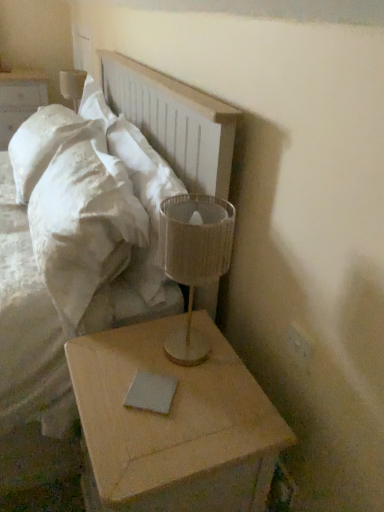
Question: From the image's perspective, is translucent fabric lampshade at right, the second table lamp positioned from the left, on top of white matte nightstand at upper left, acting as the first nightstand starting from the back?

Choices:
 (A) no
 (B) yes

Answer: (A)

Question: From a real-world perspective, is translucent fabric lampshade at right, which is counted as the 2th table lamp, starting from the back, located beneath white matte nightstand at upper left, the second nightstand in the right-to-left sequence?

Choices:
 (A) no
 (B) yes

Answer: (A)

Question: Considering the relative sizes of translucent fabric lampshade at right, the second table lamp positioned from the left, and white matte nightstand at upper left, the 1th nightstand positioned from the left, in the image provided, is translucent fabric lampshade at right, the second table lamp positioned from the left, thinner than white matte nightstand at upper left, the 1th nightstand positioned from the left,?

Choices:
 (A) yes
 (B) no

Answer: (A)

Question: Can you confirm if translucent fabric lampshade at right, which is counted as the 2th table lamp, starting from the back, is wider than white matte nightstand at upper left, the second nightstand in the right-to-left sequence?

Choices:
 (A) yes
 (B) no

Answer: (B)

Question: Does translucent fabric lampshade at right, arranged as the 1th table lamp when viewed from the right, turn towards white matte nightstand at upper left, the 1th nightstand positioned from the left?

Choices:
 (A) yes
 (B) no

Answer: (B)

Question: From the image's perspective, relative to gray matte notepad at lower center, is white plastic electric outlet at upper right above or below?

Choices:
 (A) below
 (B) above

Answer: (B)

Question: In terms of size, does white plastic electric outlet at upper right appear bigger or smaller than gray matte notepad at lower center?

Choices:
 (A) big
 (B) small

Answer: (B)

Question: In terms of width, does white plastic electric outlet at upper right look wider or thinner when compared to gray matte notepad at lower center?

Choices:
 (A) wide
 (B) thin

Answer: (B)

Question: Based on their positions, is white plastic electric outlet at upper right located to the left or right of gray matte notepad at lower center?

Choices:
 (A) left
 (B) right

Answer: (B)

Question: In terms of size, does white soft pillow at upper left appear bigger or smaller than white matte nightstand at upper left, which ranks as the second nightstand in front-to-back order?

Choices:
 (A) small
 (B) big

Answer: (A)

Question: From a real-world perspective, is white soft pillow at upper left physically located above or below white matte nightstand at upper left, which ranks as the second nightstand in front-to-back order?

Choices:
 (A) below
 (B) above

Answer: (B)

Question: Is white soft pillow at upper left situated inside white matte nightstand at upper left, the second nightstand in the right-to-left sequence, or outside?

Choices:
 (A) outside
 (B) inside

Answer: (A)

Question: From their relative heights in the image, would you say white soft pillow at upper left is taller or shorter than white matte nightstand at upper left, the second nightstand in the right-to-left sequence?

Choices:
 (A) tall
 (B) short

Answer: (B)

Question: Is white soft pillow at upper left spatially inside light wood/roughnightstand at lower right, arranged as the second nightstand when viewed from the left, or outside of it?

Choices:
 (A) outside
 (B) inside

Answer: (A)

Question: Based on their sizes in the image, would you say white soft pillow at upper left is bigger or smaller than light wood/roughnightstand at lower right, arranged as the second nightstand when viewed from the left?

Choices:
 (A) big
 (B) small

Answer: (B)